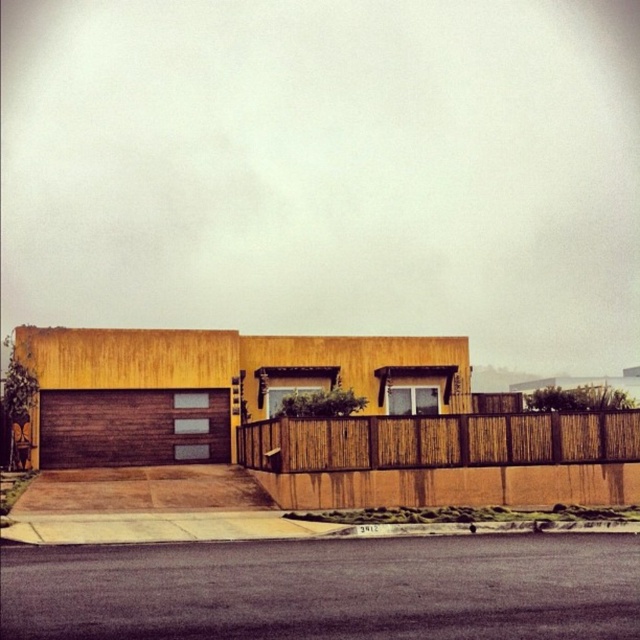
Looking at this image, who is more forward, (90, 404) or (56, 461)?

Point (56, 461)

Does brown wood garage at lower left appear under brown textured garage door at lower left?

Actually, brown wood garage at lower left is above brown textured garage door at lower left.

From the picture: Who is more forward, (240, 390) or (166, 438)?

Positioned in front is point (166, 438).

This screenshot has height=640, width=640. I want to click on brown wood garage at lower left, so [x=212, y=387].

Can you confirm if bamboo fence at center is smaller than brown textured garage door at lower left?

Actually, bamboo fence at center might be larger than brown textured garage door at lower left.

Who is positioned more to the left, bamboo fence at center or brown textured garage door at lower left?

Positioned to the left is brown textured garage door at lower left.

Is point (436, 454) positioned before point (77, 460)?

Yes, point (436, 454) is closer to viewer.

Locate an element on the screen. The image size is (640, 640). bamboo fence at center is located at coordinates [436, 440].

Does brown wood garage at lower left have a smaller size compared to bamboo fence at center?

Incorrect, brown wood garage at lower left is not smaller in size than bamboo fence at center.

Is brown wood garage at lower left positioned behind bamboo fence at center?

Yes, it is behind bamboo fence at center.

The image size is (640, 640). Describe the element at coordinates (212, 387) in the screenshot. I see `brown wood garage at lower left` at that location.

Locate an element on the screen. The image size is (640, 640). brown wood garage at lower left is located at coordinates (212, 387).